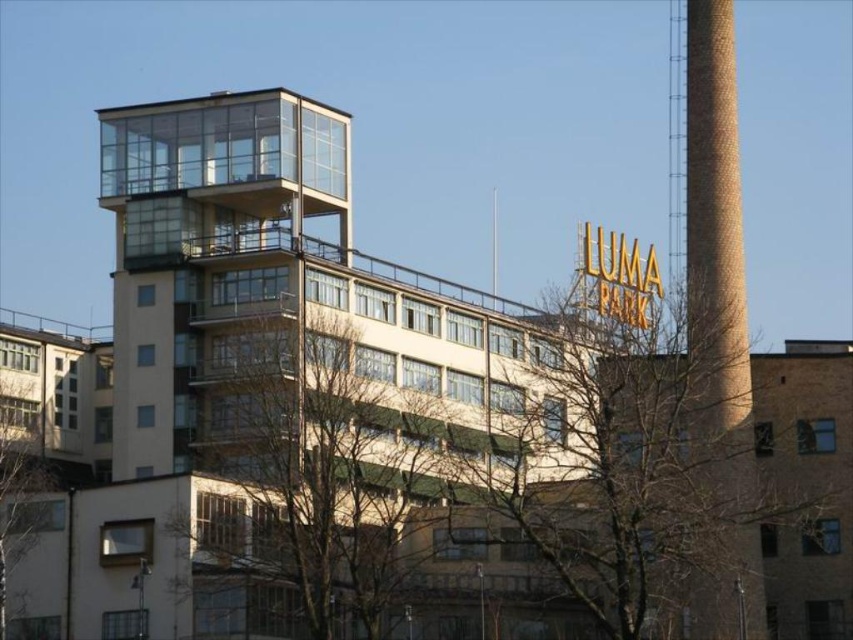
Question: Based on their relative distances, which object is farther from the bare branches at left?

Choices:
 (A) bare branches at upper center
 (B) brown brick chimney at right
 (C) bare branches at center

Answer: (B)

Question: Which point is farther to the camera?

Choices:
 (A) bare branches at center
 (B) bare branches at upper center

Answer: (A)

Question: Does bare branches at upper center appear on the left side of bare branches at left?

Choices:
 (A) yes
 (B) no

Answer: (B)

Question: Does bare branches at center appear on the right side of brown brick chimney at right?

Choices:
 (A) yes
 (B) no

Answer: (B)

Question: Which object appears closest to the camera in this image?

Choices:
 (A) bare branches at left
 (B) bare branches at upper center

Answer: (B)

Question: Can you confirm if bare branches at center is positioned above brown brick chimney at right?

Choices:
 (A) yes
 (B) no

Answer: (B)